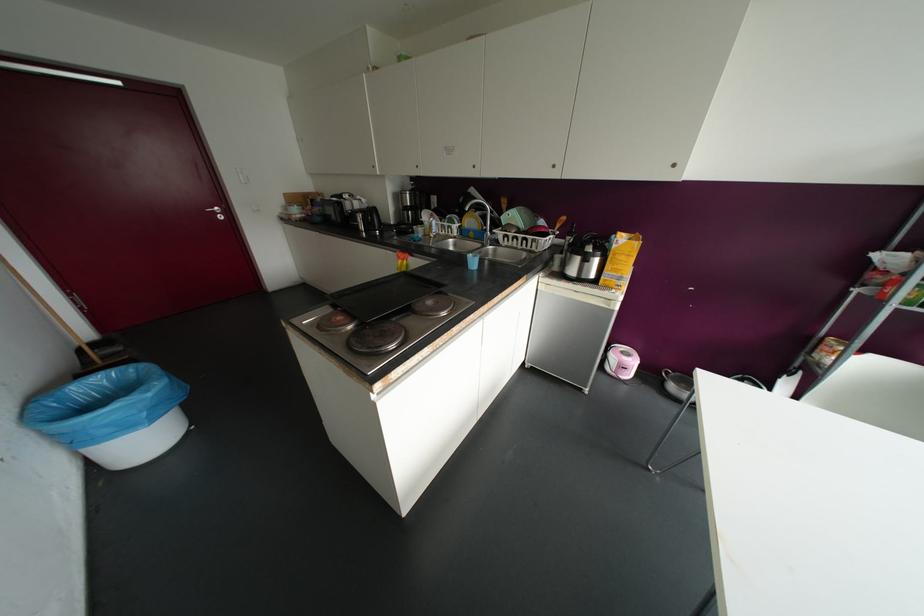
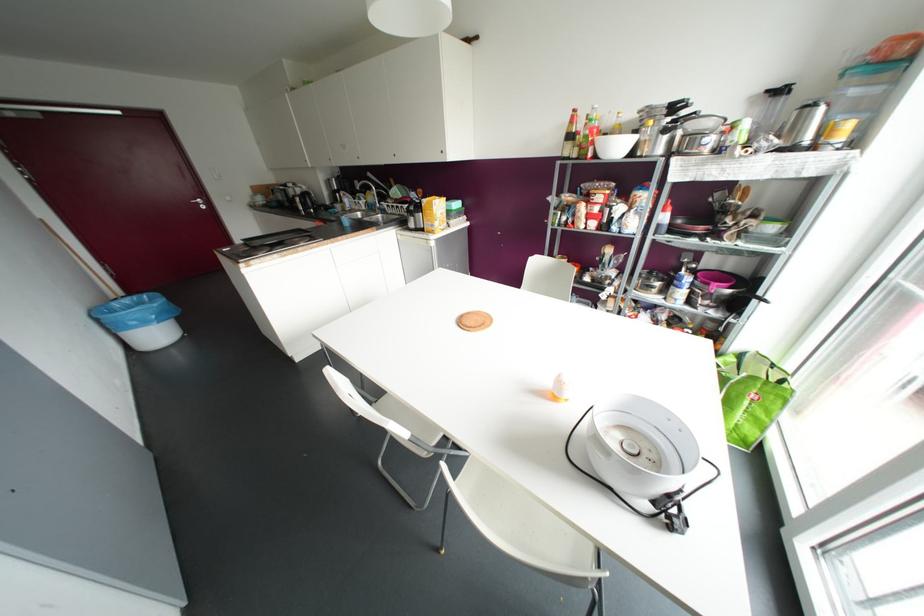
Question: I am providing you with two images of the same scene from different viewpoints. After the viewpoint changes to image2, which objects are now occluded?

Choices:
 (A) white ceramic bowl
 (B) white trash bin
 (C) pink lid handle
 (D) none of these

Answer: (D)